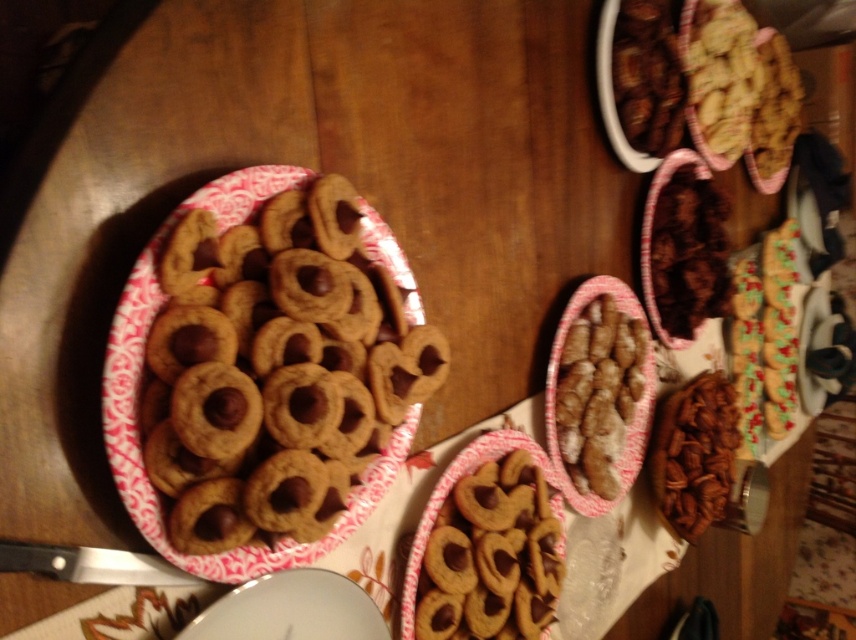
You are standing at the edge of the table looking at the baked goods. There are two points marked on the table surface. Which point is closer to you, point (698,112) or point (566,342)?

Point (698,112) is closer to you because it is further to the viewer than point (566,342).

In the scene shown: You are a customer at a bakery and want to choose a cookie that is taller. Which one should you pick between the golden brown cookie at upper right and the brown crumbly cookie at center?

The golden brown cookie at upper right has a greater height compared to the brown crumbly cookie at center, so you should pick the golden brown cookie at upper right.